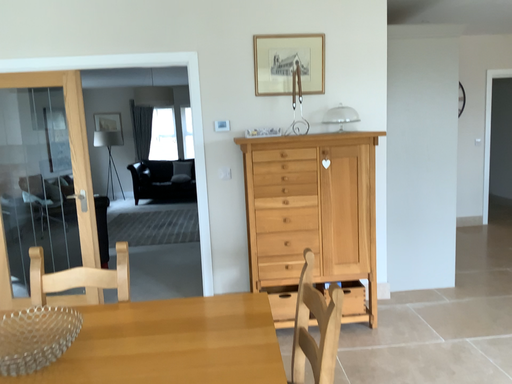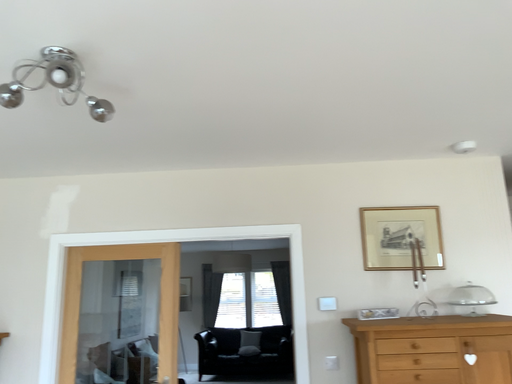
Question: Which way did the camera rotate in the video?

Choices:
 (A) rotated left
 (B) rotated right

Answer: (A)